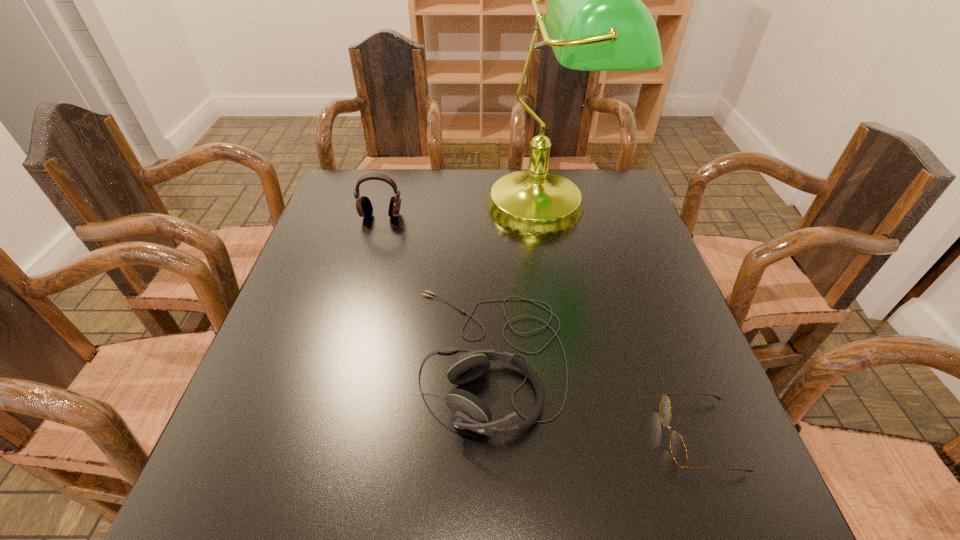
Where is `vacant space located 0.070m on the outer surface of the nearer headset`? The width and height of the screenshot is (960, 540). vacant space located 0.070m on the outer surface of the nearer headset is located at coordinates 380,358.

Locate an element on the screen. This screenshot has height=540, width=960. vacant space located on the lenses of the shortest object is located at coordinates (554, 437).

At what (x,y) coordinates should I click in order to perform the action: click on free space located 0.300m on the lenses of the shortest object. Please return your answer as a coordinate pair (x, y). Looking at the image, I should click on (499, 437).

This screenshot has height=540, width=960. I want to click on free location located 0.290m on the lenses of the shortest object, so click(x=504, y=437).

At what (x,y) coordinates should I click in order to perform the action: click on lamp that is at the far edge. Please return your answer as a coordinate pair (x, y). Looking at the image, I should click on (595, 21).

Identify the location of headset located at the far edge. pyautogui.click(x=364, y=207).

You are a GUI agent. You are given a task and a screenshot of the screen. Output one action in this format:
    pyautogui.click(x=<x>, y=<y>)
    Task: Click on the object that is at the near edge
    
    Given the screenshot: What is the action you would take?
    pyautogui.click(x=678, y=449)

The width and height of the screenshot is (960, 540). What are the coordinates of `object that is at the left edge` in the screenshot? It's located at (364, 207).

You are a GUI agent. You are given a task and a screenshot of the screen. Output one action in this format:
    pyautogui.click(x=<x>, y=<y>)
    Task: Click on the lamp at the right edge
    
    Given the screenshot: What is the action you would take?
    pyautogui.click(x=595, y=21)

The height and width of the screenshot is (540, 960). In order to click on sunglasses that is at the right edge in this screenshot , I will do `click(678, 449)`.